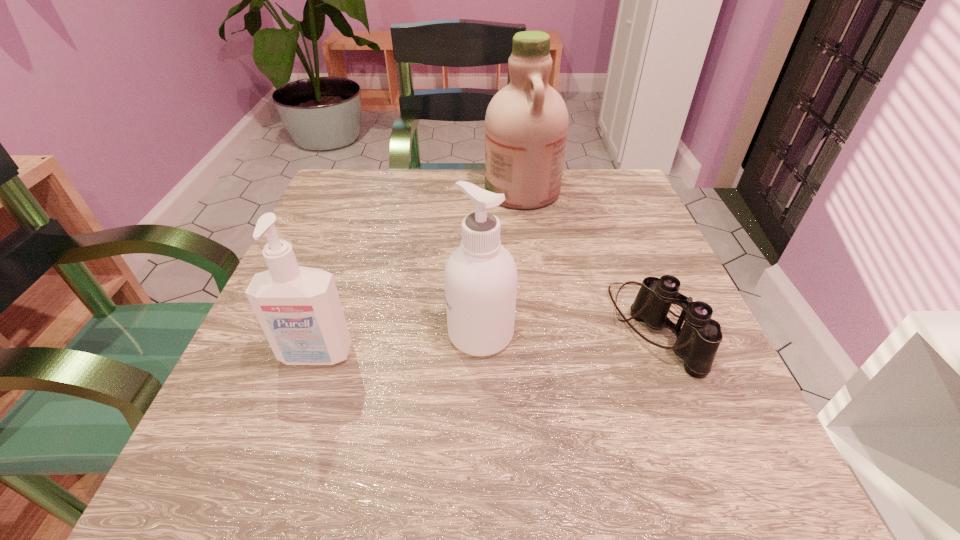
Where is `the tallest object`? the tallest object is located at coordinates (526, 123).

You are a GUI agent. You are given a task and a screenshot of the screen. Output one action in this format:
    pyautogui.click(x=<x>, y=<y>)
    Task: Click on the farthest object
    This screenshot has width=960, height=540.
    Given the screenshot: What is the action you would take?
    pyautogui.click(x=526, y=123)

You are a GUI agent. You are given a task and a screenshot of the screen. Output one action in this format:
    pyautogui.click(x=<x>, y=<y>)
    Task: Click on the leftmost cleansing agent
    This screenshot has width=960, height=540.
    Given the screenshot: What is the action you would take?
    pyautogui.click(x=299, y=309)

Identify the location of the shortest object. This screenshot has width=960, height=540. (697, 342).

The image size is (960, 540). In order to click on the rightmost object in this screenshot , I will do `click(697, 342)`.

I want to click on free space located 0.280m on the front label of the farthest object, so click(x=370, y=191).

Where is `vacant space located on the front label of the farthest object`? The height and width of the screenshot is (540, 960). vacant space located on the front label of the farthest object is located at coordinates (406, 191).

This screenshot has width=960, height=540. Identify the location of vacant space located 0.180m on the front label of the farthest object. (411, 191).

The width and height of the screenshot is (960, 540). What are the coordinates of `free space located 0.150m on the front label of the leftmost cleansing agent` in the screenshot? It's located at (276, 469).

Identify the location of free spot located on the back of the shortest object. (600, 191).